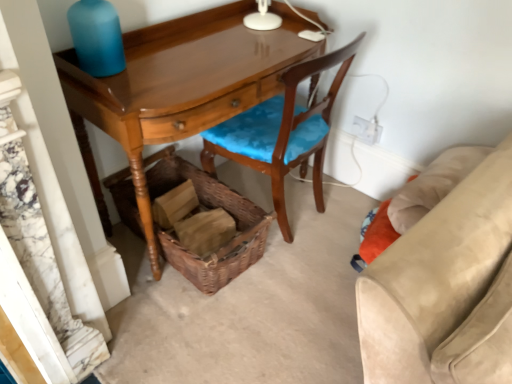
Question: Is woven brown picnic basket at lower center in contact with white plastic power outlet at upper right?

Choices:
 (A) yes
 (B) no

Answer: (B)

Question: Does woven brown picnic basket at lower center have a smaller size compared to white plastic power outlet at upper right?

Choices:
 (A) yes
 (B) no

Answer: (B)

Question: From the image's perspective, is woven brown picnic basket at lower center on white plastic power outlet at upper right?

Choices:
 (A) yes
 (B) no

Answer: (B)

Question: Considering the relative positions of woven brown picnic basket at lower center and white plastic power outlet at upper right in the image provided, is woven brown picnic basket at lower center to the right of white plastic power outlet at upper right from the viewer's perspective?

Choices:
 (A) yes
 (B) no

Answer: (B)

Question: Is woven brown picnic basket at lower center aimed at white plastic power outlet at upper right?

Choices:
 (A) no
 (B) yes

Answer: (A)

Question: Considering the positions of white plastic power outlet at upper right and glossy wood desk at center in the image, is white plastic power outlet at upper right taller or shorter than glossy wood desk at center?

Choices:
 (A) short
 (B) tall

Answer: (A)

Question: From a real-world perspective, is white plastic power outlet at upper right physically located above or below glossy wood desk at center?

Choices:
 (A) above
 (B) below

Answer: (B)

Question: Considering the relative positions of white plastic power outlet at upper right and glossy wood desk at center in the image provided, is white plastic power outlet at upper right to the left or to the right of glossy wood desk at center?

Choices:
 (A) left
 (B) right

Answer: (B)

Question: In the image, is white plastic power outlet at upper right positioned in front of or behind glossy wood desk at center?

Choices:
 (A) behind
 (B) front

Answer: (A)

Question: Is blue matte bottle at upper left bigger or smaller than white plastic power outlet at upper right?

Choices:
 (A) small
 (B) big

Answer: (B)

Question: Would you say blue matte bottle at upper left is to the left or to the right of white plastic power outlet at upper right in the picture?

Choices:
 (A) left
 (B) right

Answer: (A)

Question: Does point (110, 67) appear closer or farther from the camera than point (360, 132)?

Choices:
 (A) closer
 (B) farther

Answer: (A)

Question: Is blue matte bottle at upper left spatially inside white plastic power outlet at upper right, or outside of it?

Choices:
 (A) outside
 (B) inside

Answer: (A)

Question: Looking at the image, does glossy wood desk at center seem bigger or smaller compared to suede beige couch at lower right?

Choices:
 (A) small
 (B) big

Answer: (B)

Question: In terms of width, does glossy wood desk at center look wider or thinner when compared to suede beige couch at lower right?

Choices:
 (A) wide
 (B) thin

Answer: (B)